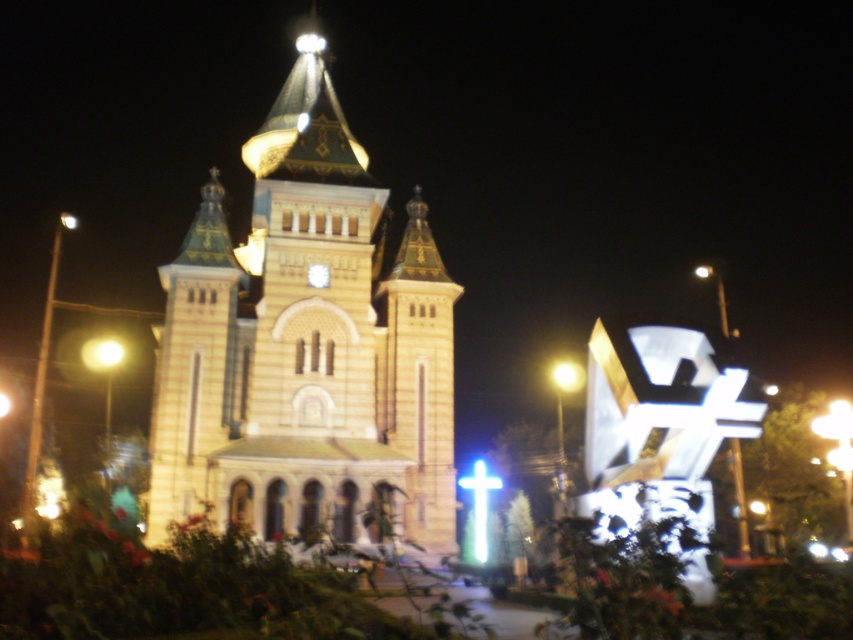
Which is above, golden stone church at center or yellow matte light at center?

golden stone church at center is above.

Is point (337, 129) farther from viewer compared to point (577, 376)?

No.

Who is more distant from viewer, (x=282, y=531) or (x=567, y=376)?

Point (x=567, y=376)

Identify the location of golden stone church at center. (306, 348).